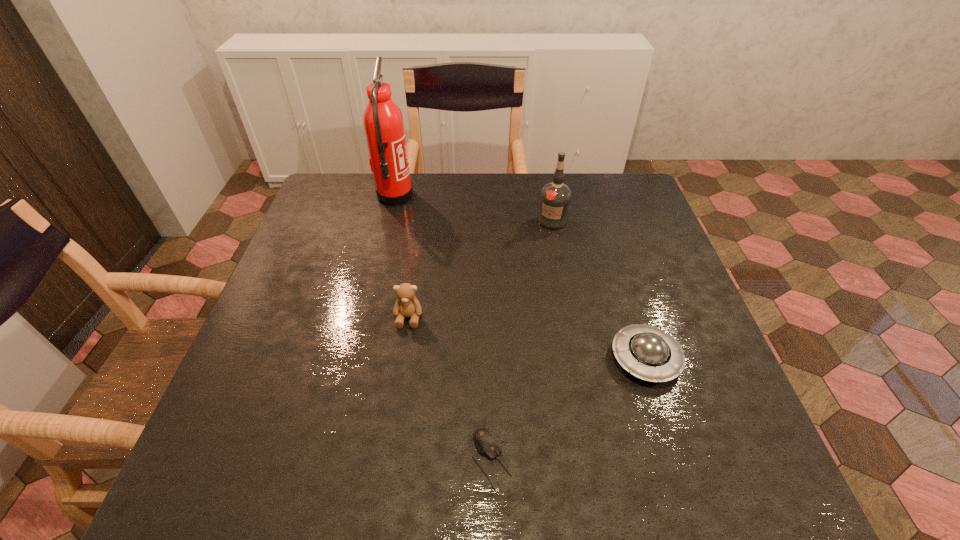
Where is `vacant region at the near edge of the desktop`? Image resolution: width=960 pixels, height=540 pixels. vacant region at the near edge of the desktop is located at coordinates (423, 453).

This screenshot has width=960, height=540. In the image, there is a desktop. Identify the location of free region at the left edge. (278, 437).

The image size is (960, 540). What are the coordinates of `vacant area at the right edge` in the screenshot? It's located at (634, 292).

Identify the location of blank space at the near left corner of the desktop. The height and width of the screenshot is (540, 960). (217, 459).

The width and height of the screenshot is (960, 540). I want to click on vacant space at the far right corner of the desktop, so click(x=639, y=205).

The width and height of the screenshot is (960, 540). I want to click on vacant area at the near right corner, so click(x=694, y=496).

Identify the location of vacant space in between the rightmost object and the tallest object. (520, 278).

I want to click on vacant area between the vodka and the saucer, so click(x=599, y=289).

You are a GUI agent. You are given a task and a screenshot of the screen. Output one action in this format:
    pyautogui.click(x=<x>, y=<y>)
    Task: Click on the vacant point located between the shortest object and the second nearest object
    
    Given the screenshot: What is the action you would take?
    pyautogui.click(x=568, y=409)

Where is `free point between the second nearest object and the nearest object`? free point between the second nearest object and the nearest object is located at coordinates (568, 409).